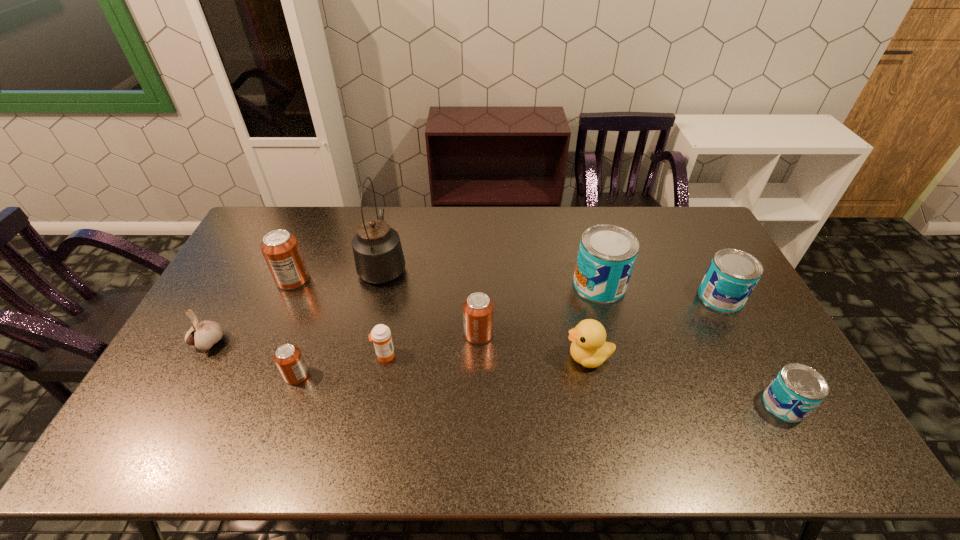
Image resolution: width=960 pixels, height=540 pixels. I want to click on free space located 0.330m on the front of the rightmost orange can, so click(x=478, y=460).

I want to click on vacant space located on the back of the second biggest blue can, so click(x=699, y=256).

I want to click on vacant point located 0.400m on the face of the duck, so click(x=420, y=357).

This screenshot has width=960, height=540. I want to click on free space located on the face of the duck, so click(485, 357).

Find the location of `vacant region located on the face of the duck`. vacant region located on the face of the duck is located at coordinates (420, 357).

This screenshot has width=960, height=540. What are the coordinates of `vacant space situated 0.220m on the back of the orange medicine` in the screenshot? It's located at (396, 293).

The height and width of the screenshot is (540, 960). What are the coordinates of `free region located 0.130m on the front of the garlic` in the screenshot? It's located at (179, 398).

Where is `blank space located 0.080m on the left of the third object from left to right`? The height and width of the screenshot is (540, 960). blank space located 0.080m on the left of the third object from left to right is located at coordinates (255, 375).

In order to click on free location located 0.260m on the back of the smallest blue can in this screenshot , I will do `click(734, 313)`.

You are a GUI agent. You are given a task and a screenshot of the screen. Output one action in this format:
    pyautogui.click(x=<x>, y=<y>)
    Task: Click on the object at the far edge
    This screenshot has width=960, height=540.
    Given the screenshot: What is the action you would take?
    pyautogui.click(x=378, y=254)